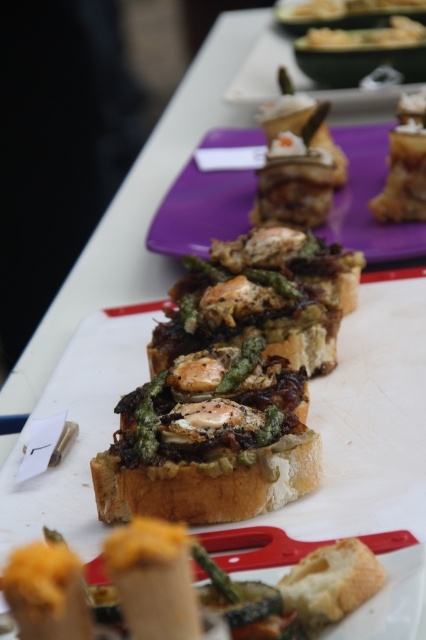
You are a chef arranging ingredients on a matte purple plate at center and golden brown crusty bread at center. Since the plate is wider than the bread, where should you place the bread to ensure it fits entirely on the plate?

The golden brown crusty bread at center should be placed centrally on the matte purple plate at center since the plate is wider than the bread, allowing it to fit entirely without overhanging the edges.

You are a food stylist arranging a photo shoot. You need to place a decorative garnish on the highest point of the setup. Which object should you place it on, the matte purple plate at center or the golden brown crusty bread at center?

The matte purple plate at center is above the golden brown crusty bread at center, so you should place the garnish on the matte purple plate at center as it is the highest point.